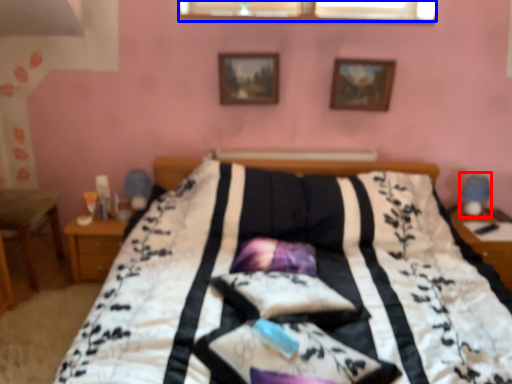
Question: Which object appears closest to the camera in this image, table lamp (highlighted by a red box) or window (highlighted by a blue box)?

Choices:
 (A) table lamp
 (B) window

Answer: (A)